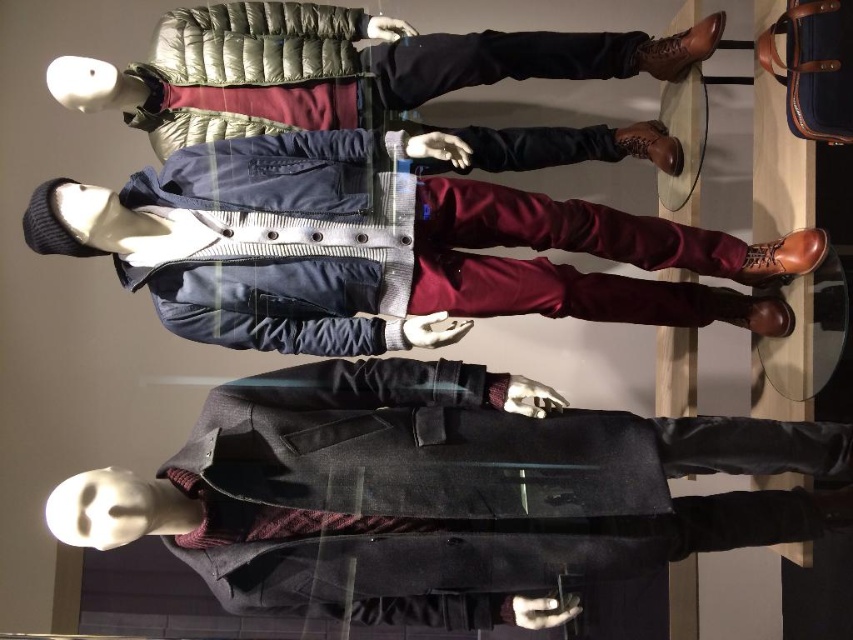
Is dark gray wool coat at center smaller than matte blue jacket at center?

No, dark gray wool coat at center is not smaller than matte blue jacket at center.

Can you confirm if dark gray wool coat at center is shorter than matte blue jacket at center?

Incorrect, dark gray wool coat at center's height does not fall short of matte blue jacket at center's.

I want to click on dark gray wool coat at center, so click(x=440, y=492).

At what (x,y) coordinates should I click in order to perform the action: click on dark gray wool coat at center. Please return your answer as a coordinate pair (x, y). Looking at the image, I should click on (440, 492).

Measure the distance between point (427, 145) and camera.

They are 6.14 feet apart.

Is point (427, 268) farther from camera compared to point (157, 29)?

No, (427, 268) is in front of (157, 29).

Does point (309, 321) lie in front of point (175, 33)?

Yes, it is in front of point (175, 33).

Find the location of `matte blue jacket at center`. matte blue jacket at center is located at coordinates (390, 250).

Does dark gray wool coat at center have a lesser width compared to matte black jacket at center?

In fact, dark gray wool coat at center might be wider than matte black jacket at center.

Is point (650, 433) closer to camera compared to point (482, 134)?

That is True.

You are a GUI agent. You are given a task and a screenshot of the screen. Output one action in this format:
    pyautogui.click(x=<x>, y=<y>)
    Task: Click on the dark gray wool coat at center
    The width and height of the screenshot is (853, 640).
    Given the screenshot: What is the action you would take?
    pyautogui.click(x=440, y=492)

At what (x,y) coordinates should I click in order to perform the action: click on dark gray wool coat at center. Please return your answer as a coordinate pair (x, y). Image resolution: width=853 pixels, height=640 pixels. Looking at the image, I should click on (440, 492).